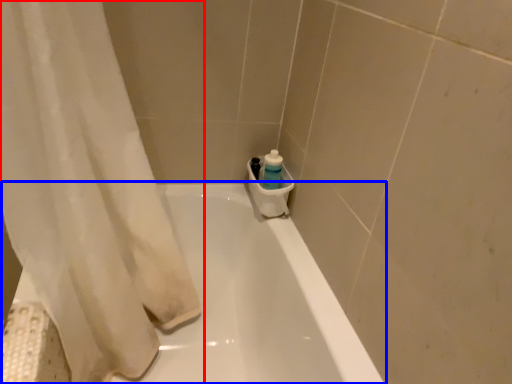
Question: Among these objects, which one is farthest to the camera, curtain (highlighted by a red box) or bathtub (highlighted by a blue box)?

Choices:
 (A) curtain
 (B) bathtub

Answer: (B)